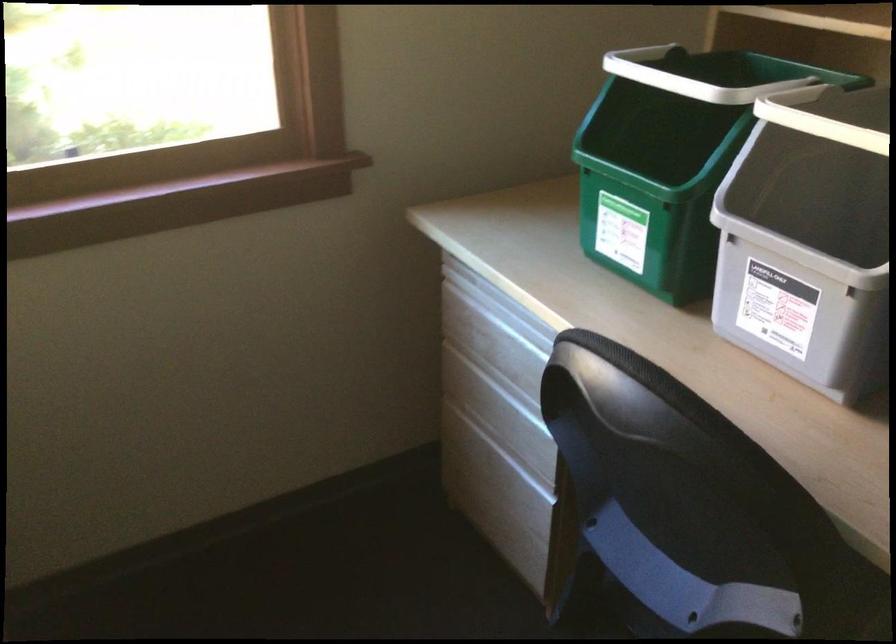
Where is `white bin rim`? This screenshot has width=896, height=644. white bin rim is located at coordinates (797, 250).